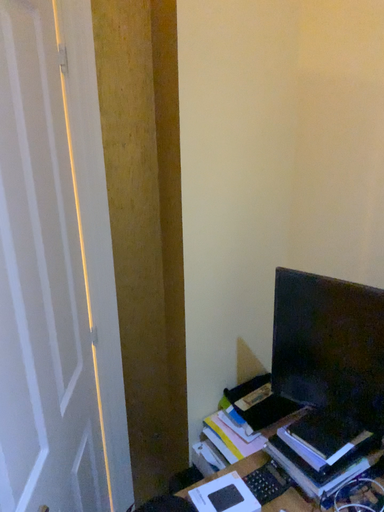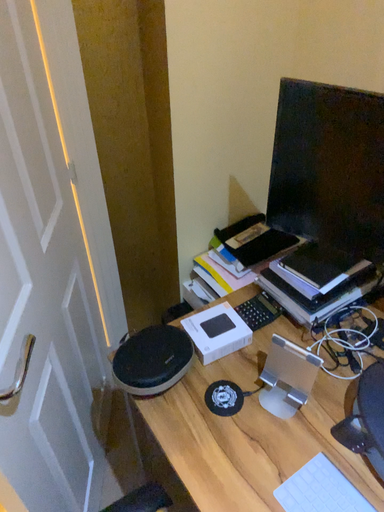
Question: How did the camera likely rotate when shooting the video?

Choices:
 (A) rotated downward
 (B) rotated upward

Answer: (A)